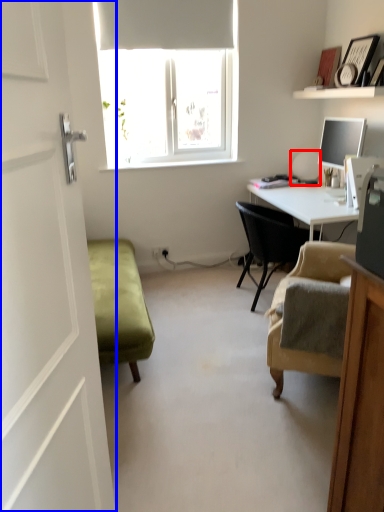
Question: Which object is closer to the camera taking this photo, table lamp (highlighted by a red box) or screen door (highlighted by a blue box)?

Choices:
 (A) table lamp
 (B) screen door

Answer: (B)